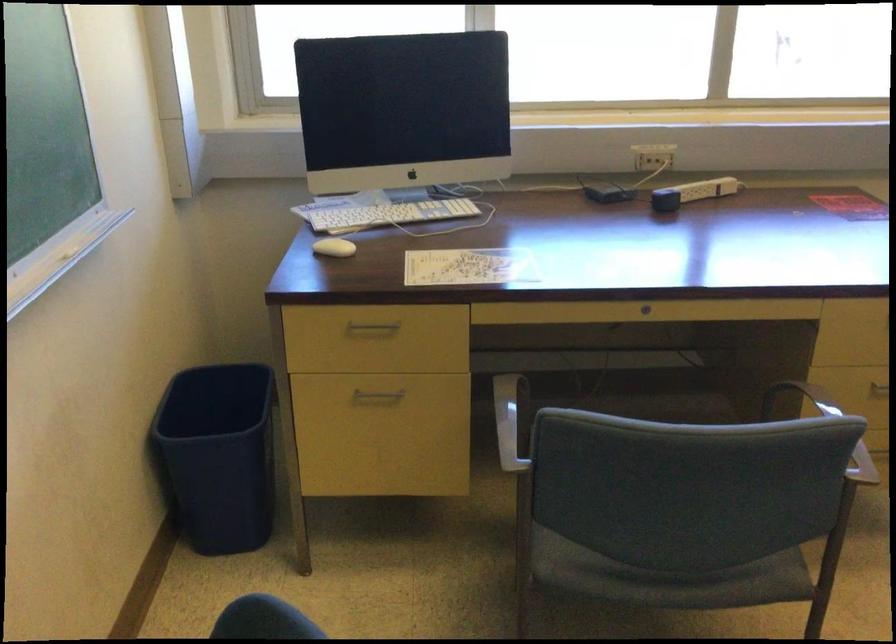
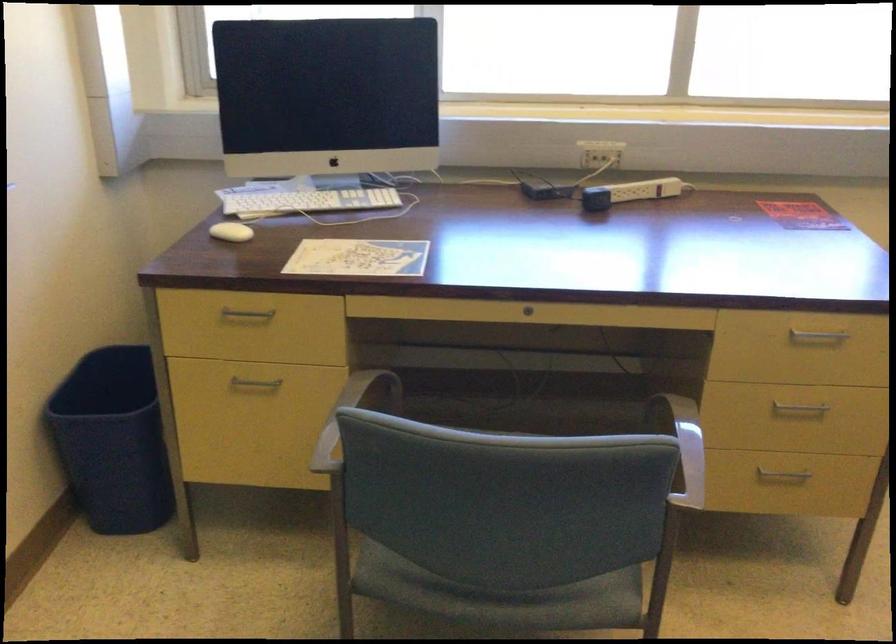
Question: The images are taken continuously from a first-person perspective. In which direction are you moving?

Choices:
 (A) Left
 (B) Right
 (C) Forward
 (D) Backward

Answer: (B)